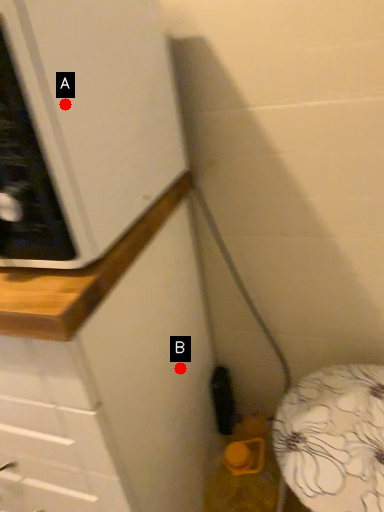
Question: Two points are circled on the image, labeled by A and B beside each circle. Which of the following is the farthest from the observer?

Choices:
 (A) A is further
 (B) B is further

Answer: (B)